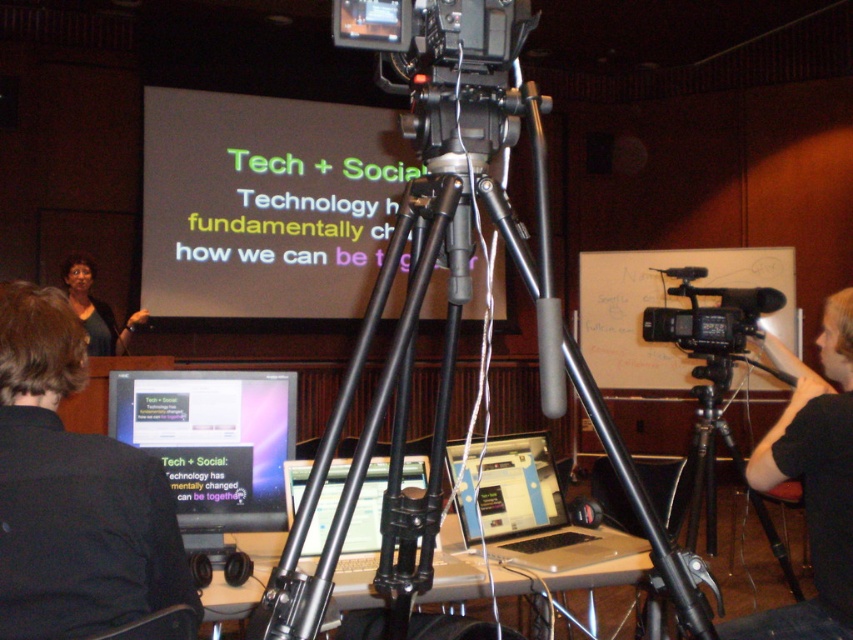
Question: Does matte black projector screen at center have a greater width compared to matte black screen at center?

Choices:
 (A) no
 (B) yes

Answer: (B)

Question: Does black metal tripod at center appear on the right side of beige plastic laptop at center?

Choices:
 (A) no
 (B) yes

Answer: (A)

Question: Which point is farther to the camera?

Choices:
 (A) matte black projector screen at center
 (B) matte black shirt at left
 (C) matte black monitor at center
 (D) black plastic video camera at center

Answer: (A)

Question: Which point is closer to the camera taking this photo?

Choices:
 (A) (123, 349)
 (B) (694, 324)
 (C) (490, 509)

Answer: (C)

Question: Is black metal tripod at center further to camera compared to matte black screen at center?

Choices:
 (A) no
 (B) yes

Answer: (A)

Question: Which point is closer to the camera taking this photo?

Choices:
 (A) (720, 308)
 (B) (79, 294)

Answer: (A)